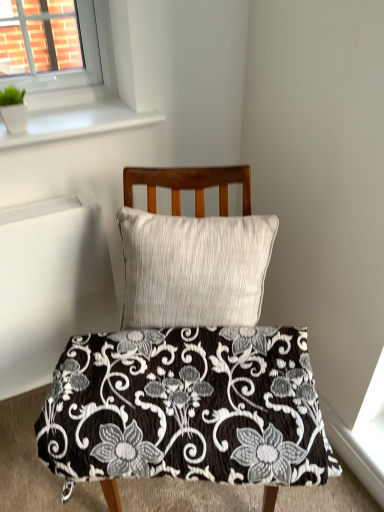
Question: Is white plastic window at upper left spatially inside white glossy window sill at upper left, or outside of it?

Choices:
 (A) outside
 (B) inside

Answer: (A)

Question: Considering the positions of point (129, 116) and point (4, 133), is point (129, 116) closer or farther from the camera than point (4, 133)?

Choices:
 (A) farther
 (B) closer

Answer: (A)

Question: Estimate the real-world distances between objects in this image. Which object is farther from the black quilted cushion at center?

Choices:
 (A) white plastic radiator at left
 (B) white textured pillow at center
 (C) white plastic window at upper left
 (D) black quilted fabric at center
 (E) white glossy window sill at upper left

Answer: (E)

Question: Which is nearer to the white plastic radiator at left?

Choices:
 (A) white ceramic pot at upper left
 (B) black quilted cushion at center
 (C) white plastic window at upper left
 (D) white glossy window sill at upper left
 (E) black quilted fabric at center

Answer: (B)